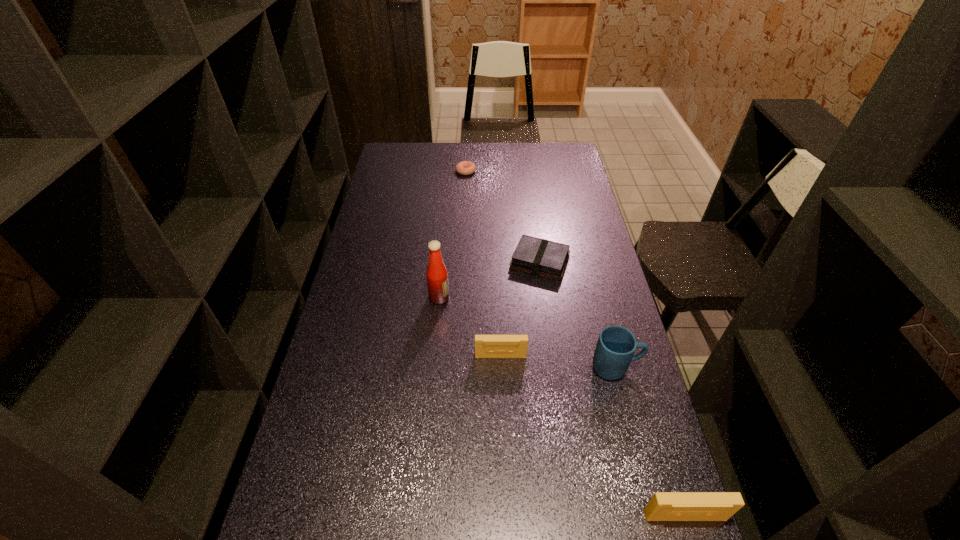
Identify the location of vacant place for an extra videotape on the left. The image size is (960, 540). (387, 257).